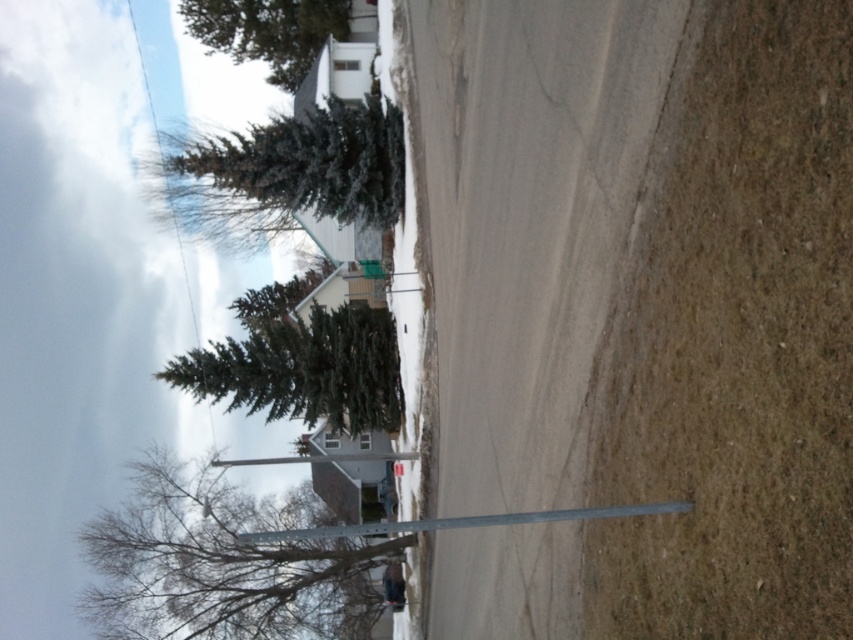
You are standing on the residential street and looking towards the green textured pine tree at upper center and the black matte skier at center. Which object is closer to you?

The green textured pine tree at upper center is closer to you because it is in front of the black matte skier at center.

You are a landscape architect designing a garden and want to place both the green textured evergreen at upper left and the green matte evergreen tree at upper left in a row. Which one should you place first if you want the larger tree to be at the beginning of the row?

You should place the green textured evergreen at upper left first because it is larger in size than the green matte evergreen tree at upper left.